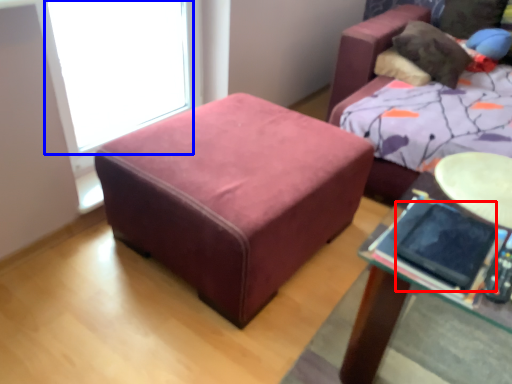
Question: Which point is closer to the camera, ipad (highlighted by a red box) or window screen (highlighted by a blue box)?

Choices:
 (A) ipad
 (B) window screen

Answer: (A)